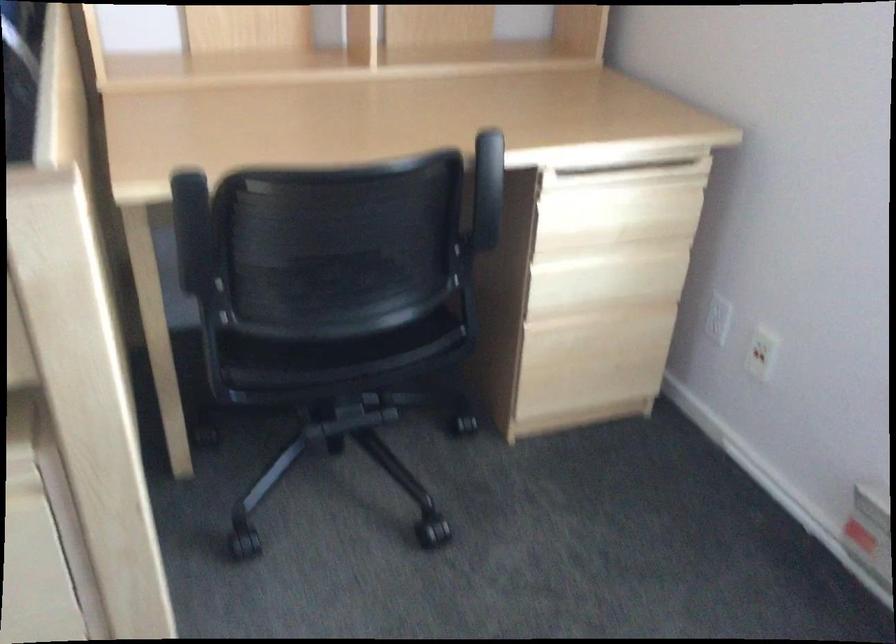
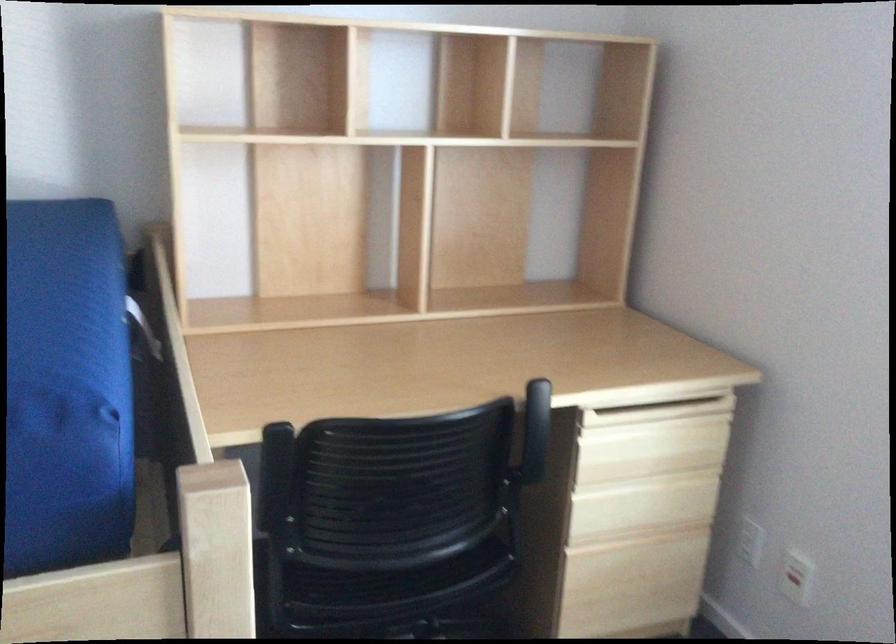
Find the pixel in the second image that matches (x=757, y=355) in the first image.

(795, 583)